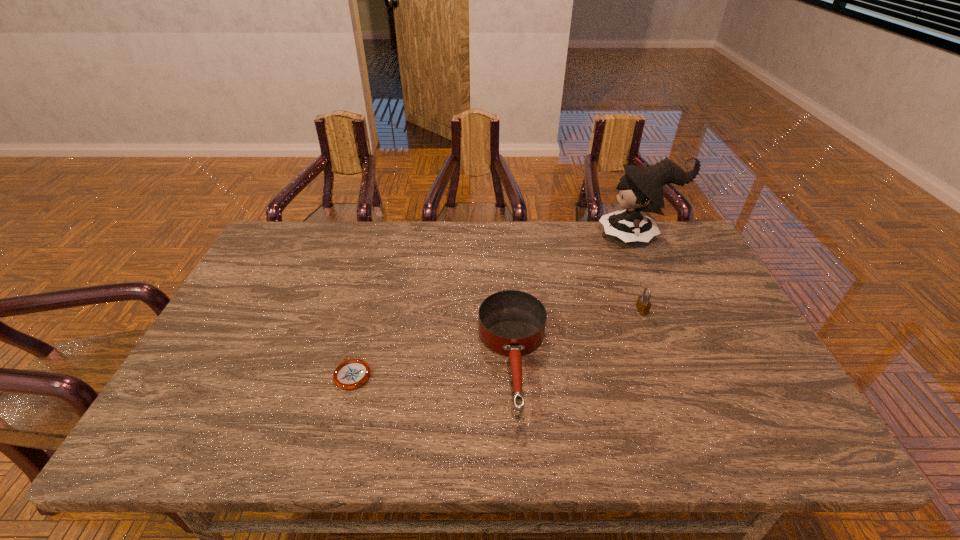
What are the coordinates of `the second closest object to the tallest object` in the screenshot? It's located at (512, 323).

Find the location of a particular element. The height and width of the screenshot is (540, 960). object that is the third closest to the leftmost object is located at coordinates [x=641, y=189].

I want to click on vacant area in the image that satisfies the following two spatial constraints: 1. at the face of the farthest object; 2. on the handle side of the second object from left to right, so click(x=695, y=360).

The height and width of the screenshot is (540, 960). I want to click on free region that satisfies the following two spatial constraints: 1. at the face of the doll; 2. on the handle side of the pan, so click(x=695, y=360).